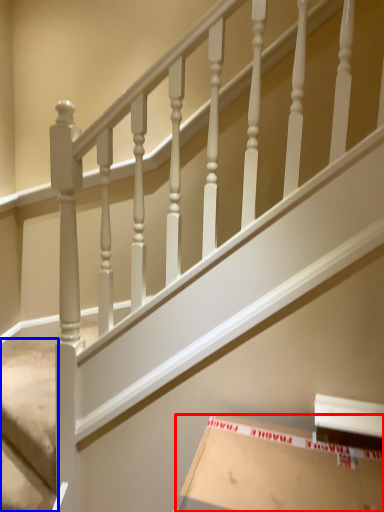
Question: Which object appears closest to the camera in this image, cardboard box (highlighted by a red box) or stairwell (highlighted by a blue box)?

Choices:
 (A) cardboard box
 (B) stairwell

Answer: (A)